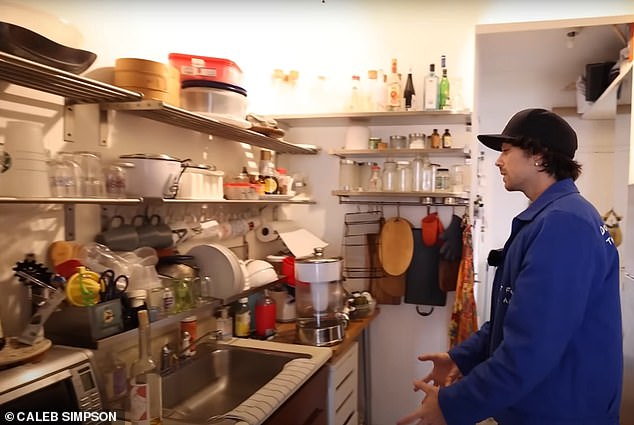
Locate an element on the screen. sink is located at coordinates (212, 386).